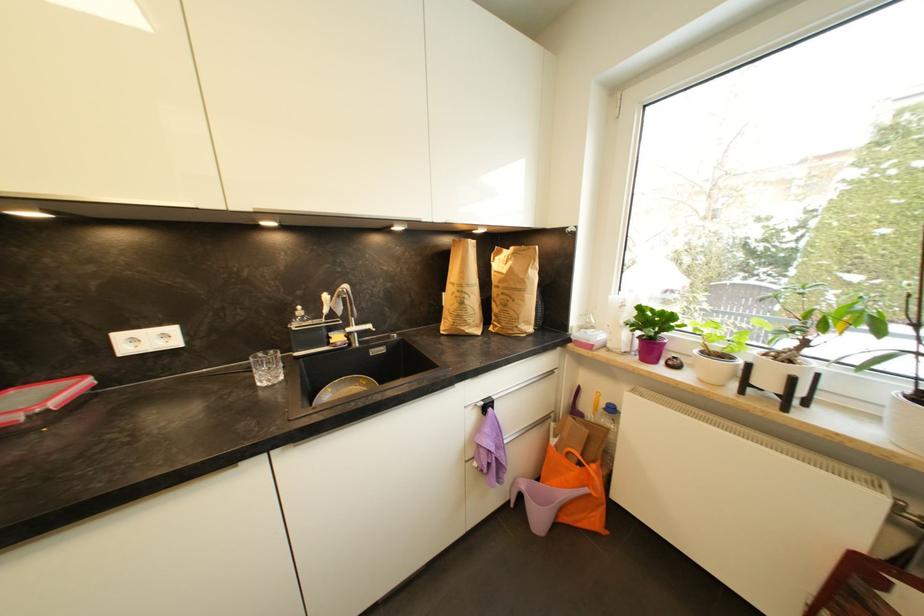
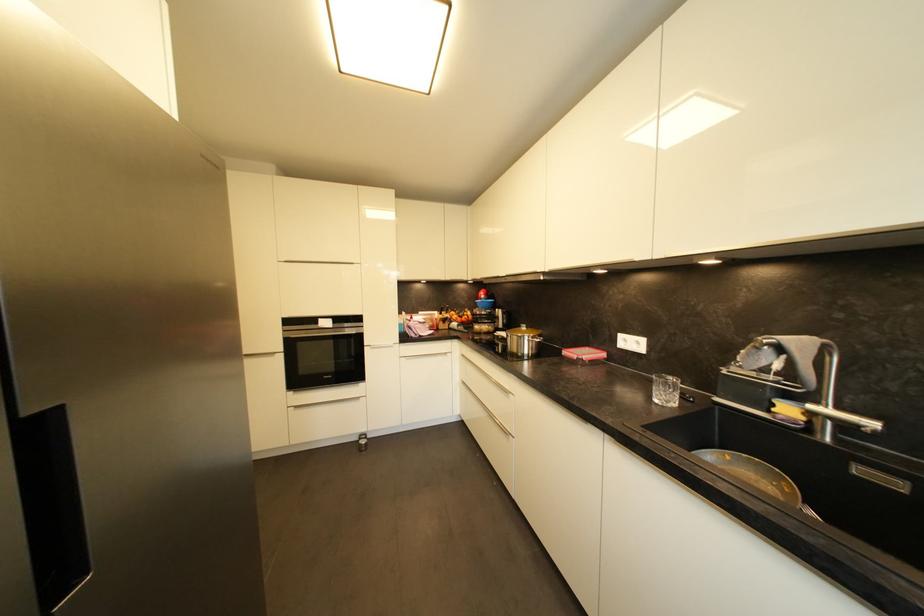
Where in the second image is the point corresponding to point 386,352 from the first image?

(904, 487)